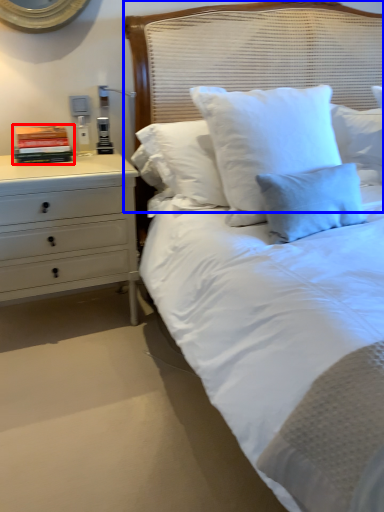
Question: Which of the following is the farthest to the observer, book (highlighted by a red box) or headboard (highlighted by a blue box)?

Choices:
 (A) book
 (B) headboard

Answer: (A)